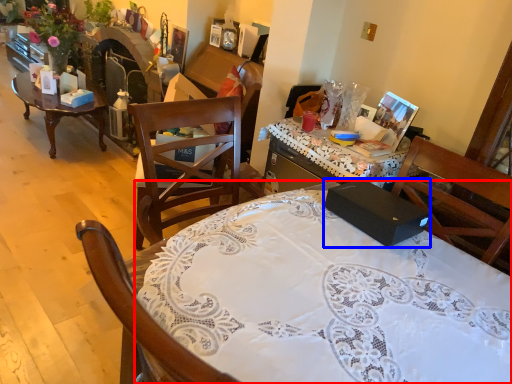
Question: Which object is closer to the camera taking this photo, desk (highlighted by a red box) or box (highlighted by a blue box)?

Choices:
 (A) desk
 (B) box

Answer: (A)